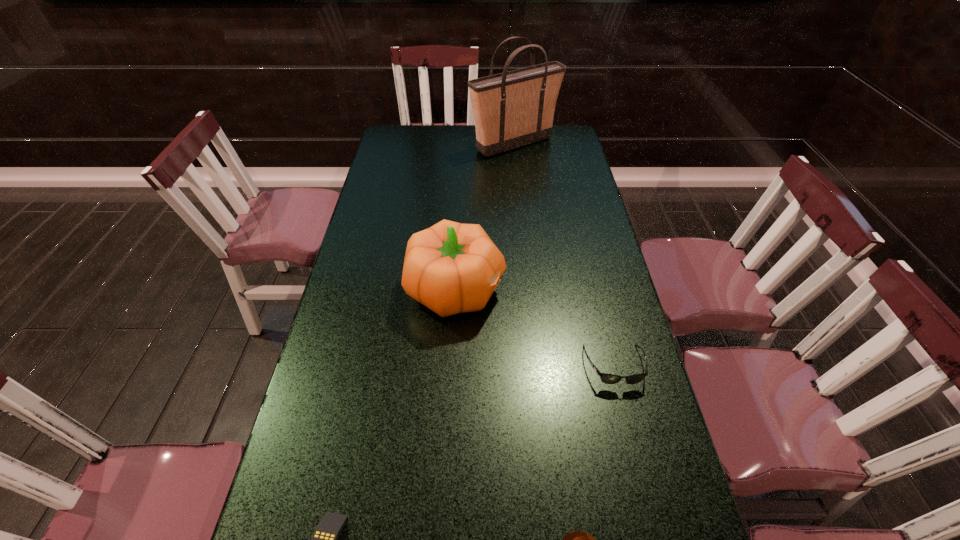
Locate an element on the screen. The image size is (960, 540). the farthest object is located at coordinates (512, 109).

What are the coordinates of `the tallest object` in the screenshot? It's located at (512, 109).

This screenshot has height=540, width=960. I want to click on the fourth shortest object, so click(451, 267).

Identify the location of pumpkin. The image size is (960, 540). (451, 267).

Find the location of a particular element. the third farthest object is located at coordinates (606, 378).

Image resolution: width=960 pixels, height=540 pixels. I want to click on blank space located on the front of the farthest object, so click(x=518, y=183).

Where is `vacant space situated on the carved face of the fourth nearest object`? vacant space situated on the carved face of the fourth nearest object is located at coordinates (611, 289).

I want to click on vacant space located on the front-facing side of the third farthest object, so click(655, 531).

You are a GUI agent. You are given a task and a screenshot of the screen. Output one action in this format:
    pyautogui.click(x=<x>, y=<y>)
    Task: Click on the object that is positioned at the far edge
    Image resolution: width=960 pixels, height=540 pixels.
    Given the screenshot: What is the action you would take?
    pyautogui.click(x=512, y=109)

This screenshot has height=540, width=960. Find the location of `shopping bag that is positioned at the right edge`. shopping bag that is positioned at the right edge is located at coordinates (512, 109).